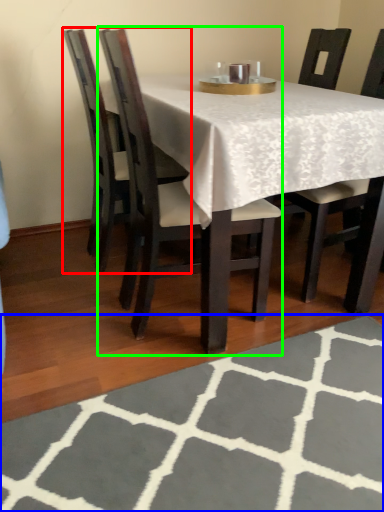
Question: Which is farther away from chair (highlighted by a red box)? place mat (highlighted by a blue box) or chair (highlighted by a green box)?

Choices:
 (A) place mat
 (B) chair

Answer: (A)